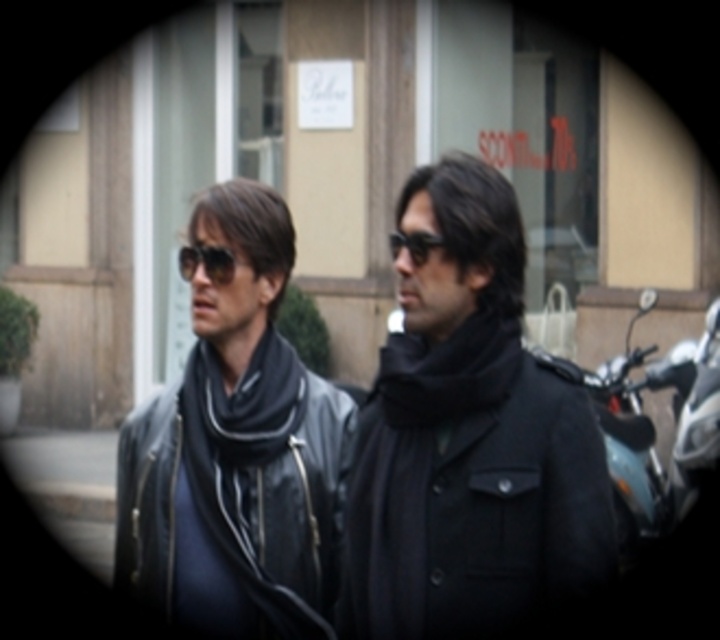
Question: Is black leather jacket at center above black leather jacket at left?

Choices:
 (A) yes
 (B) no

Answer: (A)

Question: Which of the following is the closest to the observer?

Choices:
 (A) black leather jacket at center
 (B) black soft scarf at left
 (C) black reflective sunglasses at center
 (D) black leather jacket at left

Answer: (A)

Question: Does black leather jacket at center have a larger size compared to black leather jacket at left?

Choices:
 (A) no
 (B) yes

Answer: (B)

Question: Is black leather jacket at center behind black soft scarf at left?

Choices:
 (A) yes
 (B) no

Answer: (B)

Question: Which object appears farthest from the camera in this image?

Choices:
 (A) matte black jacket at center
 (B) black leather jacket at left

Answer: (B)

Question: Based on their relative distances, which object is nearer to the black leather jacket at left?

Choices:
 (A) black soft scarf at left
 (B) black leather jacket at center

Answer: (A)